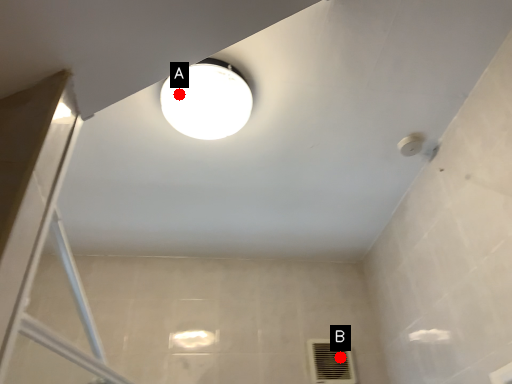
Question: Two points are circled on the image, labeled by A and B beside each circle. Which point is farther from the camera taking this photo?

Choices:
 (A) A is further
 (B) B is further

Answer: (B)